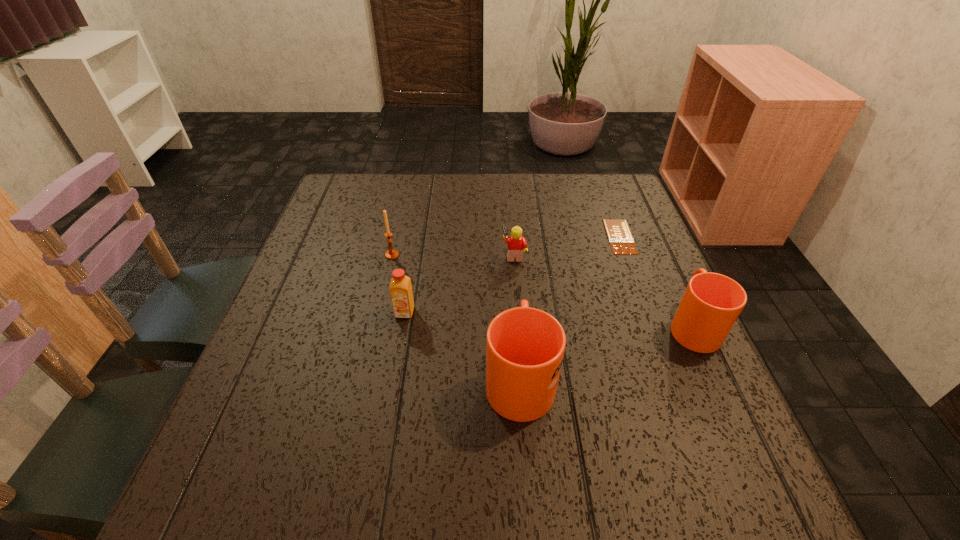
Identify the location of chocolate bar present at the right edge. This screenshot has height=540, width=960. (621, 241).

Locate an element on the screen. Image resolution: width=960 pixels, height=540 pixels. free space at the far edge of the desktop is located at coordinates (413, 214).

The width and height of the screenshot is (960, 540). In the image, there is a desktop. What are the coordinates of `free space at the near edge` in the screenshot? It's located at (411, 435).

Find the location of a particular element. The height and width of the screenshot is (540, 960). vacant space at the left edge is located at coordinates (364, 237).

Where is `free region at the right edge`? This screenshot has height=540, width=960. free region at the right edge is located at coordinates (649, 263).

Where is `vacant space at the far left corner`? vacant space at the far left corner is located at coordinates (359, 191).

The image size is (960, 540). In the image, there is a desktop. Find the location of `free region at the near left corner`. free region at the near left corner is located at coordinates (237, 428).

Locate an element on the screen. vacant space at the far right corner of the desktop is located at coordinates (588, 189).

You are a GUI agent. You are given a task and a screenshot of the screen. Output one action in this format:
    pyautogui.click(x=<x>, y=<y>)
    Task: Click on the free location at the near right corner
    
    Given the screenshot: What is the action you would take?
    pyautogui.click(x=675, y=435)

The height and width of the screenshot is (540, 960). Identify the location of vacant space that's between the taller mug and the second object from left to right. (462, 345).